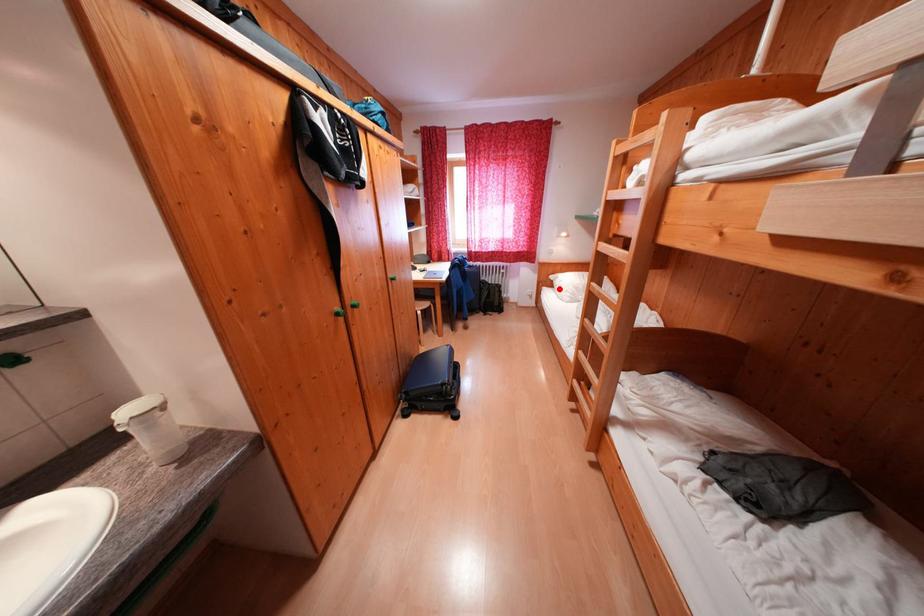
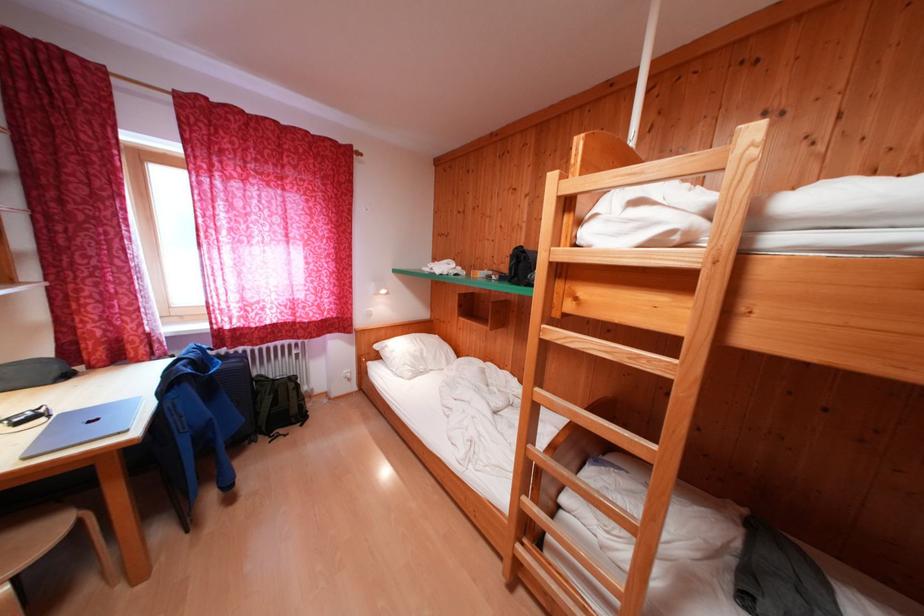
Question: I am providing you with two images of the same scene from different viewpoints. A red point is marked on the first image. Can you still see the location of the red point in image 2?

Choices:
 (A) Yes
 (B) No

Answer: (A)